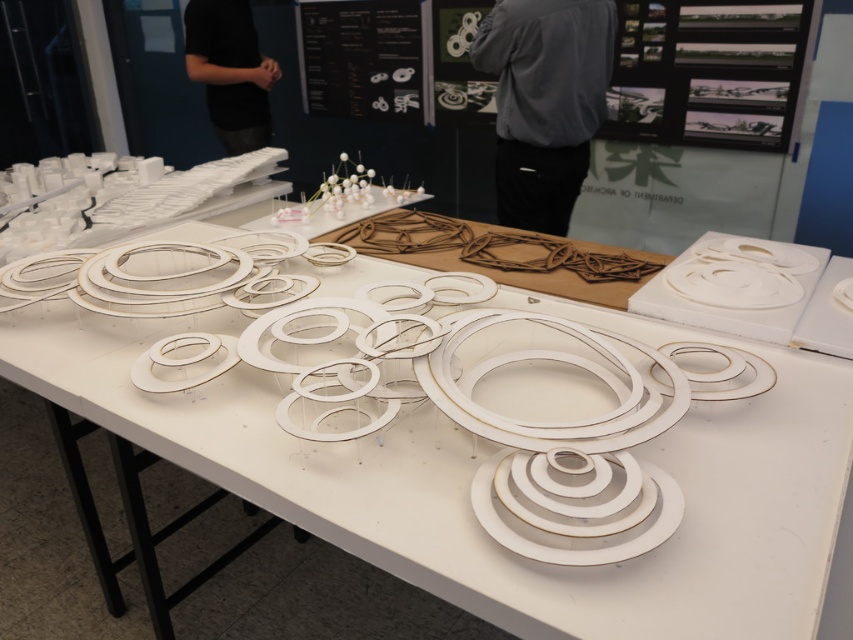
You are an event organizer at the exhibition and need to place a new decorative item on the table. The item requires a specific location marked by the coordinates point (465, 429). According to the scene description, where exactly should you place the new item?

The point (465, 429) corresponds to the white cardboard circles at center, so you should place the new item there.

You are a guest at the exhibition and want to place a small decorative item on the table. You have a choice between placing it on top of the gray fabric pants at center or the white matte plate at center. Considering their heights, which object would allow the item to be more visible to people walking around the table?

The gray fabric pants at center has a greater height compared to the white matte plate at center, so placing the item on top of the gray fabric pants at center would make it more visible to people walking around the table.